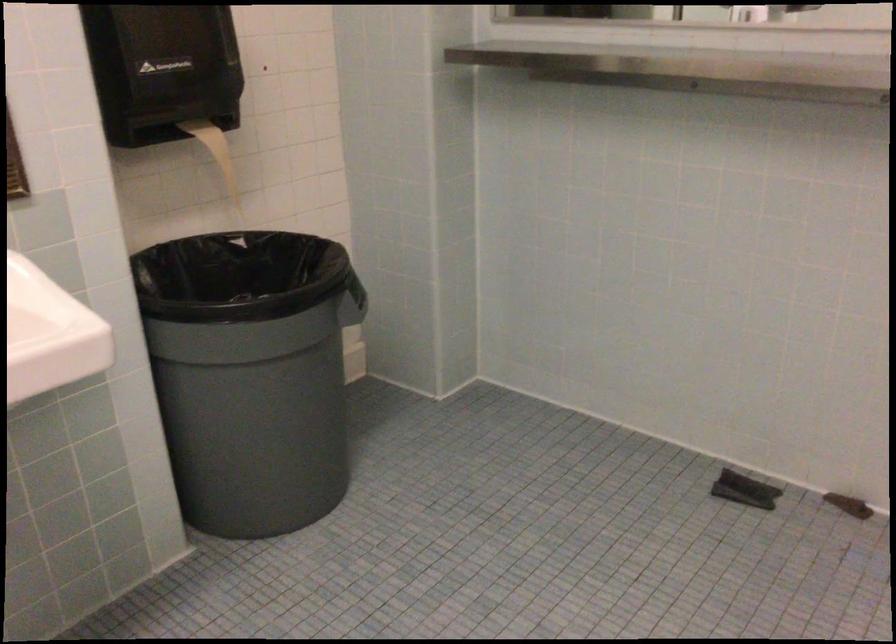
The image size is (896, 644). What are the coordinates of `trash can rim` in the screenshot? It's located at (228, 266).